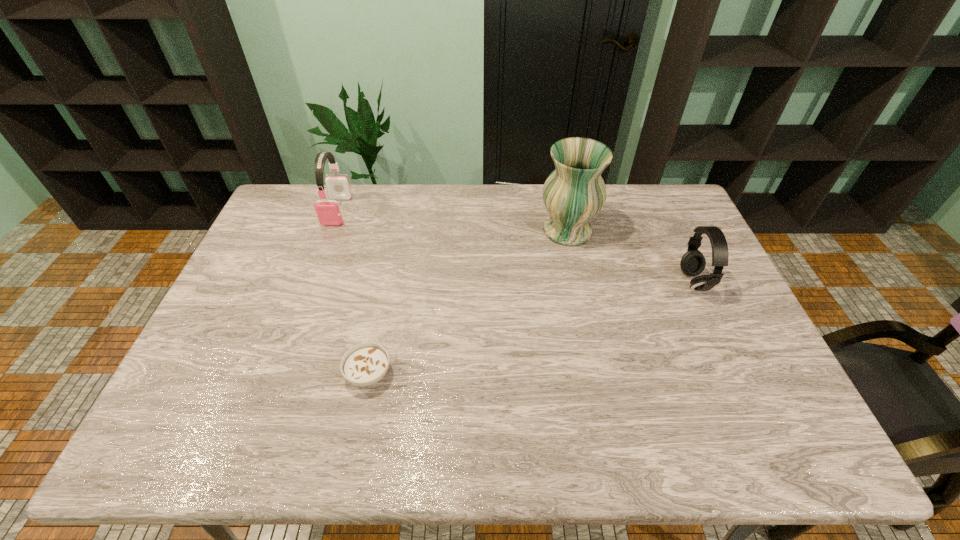
The width and height of the screenshot is (960, 540). I want to click on the tallest object, so click(x=574, y=193).

Where is `vase`? The width and height of the screenshot is (960, 540). vase is located at coordinates (574, 193).

Identify the location of the left earphone. This screenshot has width=960, height=540. (328, 211).

Locate an element on the screen. Image resolution: width=960 pixels, height=540 pixels. the farther earphone is located at coordinates (328, 211).

Identify the location of the right earphone. The image size is (960, 540). (693, 262).

You are a GUI agent. You are given a task and a screenshot of the screen. Output one action in this format:
    pyautogui.click(x=<x>, y=<y>)
    Task: Click on the nearer earphone
    
    Given the screenshot: What is the action you would take?
    pyautogui.click(x=693, y=262)

Where is `the third object from right to left`? This screenshot has height=540, width=960. the third object from right to left is located at coordinates (365, 364).

The image size is (960, 540). In order to click on the shortest object in this screenshot , I will do `click(365, 364)`.

You are a GUI agent. You are given a task and a screenshot of the screen. Output one action in this format:
    pyautogui.click(x=<x>, y=<y>)
    Task: Click on the free space located on the right of the tallest object
    Image resolution: width=960 pixels, height=540 pixels.
    Given the screenshot: What is the action you would take?
    pyautogui.click(x=638, y=231)

The height and width of the screenshot is (540, 960). Identify the location of vacant region located on the outer surface of the farther earphone. (306, 294).